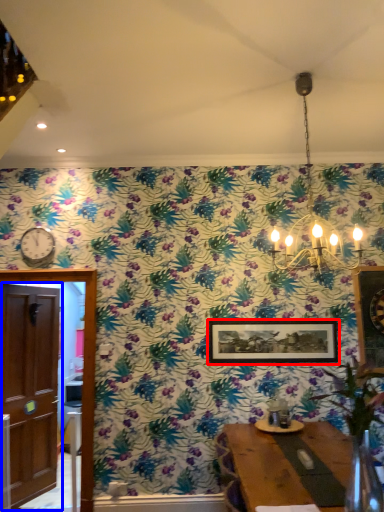
Question: Which object appears farthest to the camera in this image, picture frame (highlighted by a red box) or door (highlighted by a blue box)?

Choices:
 (A) picture frame
 (B) door

Answer: (A)